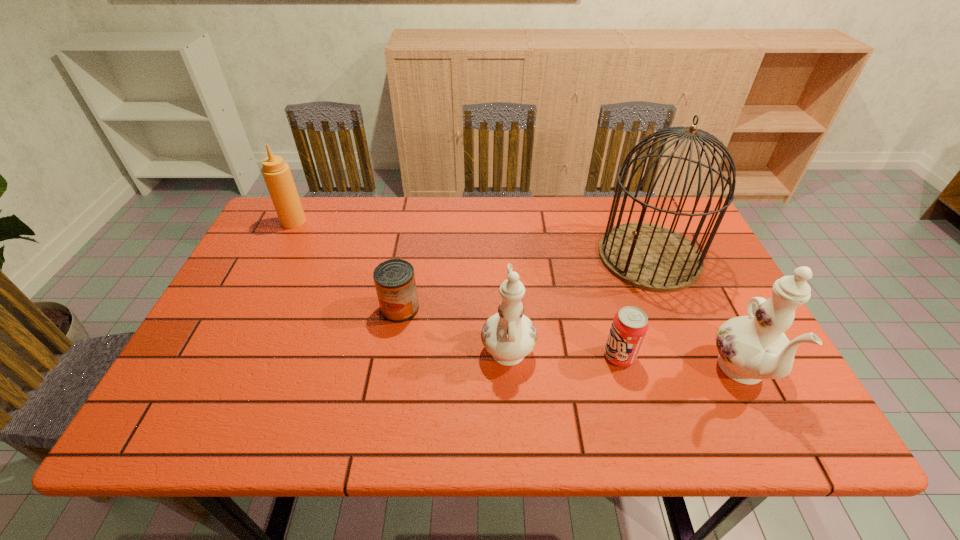
Find the location of a particular element. the left chinaware is located at coordinates (509, 336).

Identify the location of the shorter chinaware. (509, 336).

Locate an element on the screen. The height and width of the screenshot is (540, 960). the right chinaware is located at coordinates (751, 348).

You are a GUI agent. You are given a task and a screenshot of the screen. Output one action in this format:
    pyautogui.click(x=<x>, y=<y>)
    Task: Click on the condiment
    
    Given the screenshot: What is the action you would take?
    pyautogui.click(x=277, y=175)

You are a GUI agent. You are given a task and a screenshot of the screen. Output one action in this format:
    pyautogui.click(x=<x>, y=<y>)
    Task: Click on the birdcage
    This screenshot has width=960, height=540.
    Given the screenshot: What is the action you would take?
    pyautogui.click(x=648, y=256)

Locate an element on the screen. the fifth object from right to left is located at coordinates (394, 279).

Where is `soda can`? The width and height of the screenshot is (960, 540). soda can is located at coordinates (630, 325).

Identify the location of vacant space located at the spout of the fourth object from right to left. Image resolution: width=960 pixels, height=540 pixels. coord(505,300).

Where is `free space located at the spout of the fourth object from right to left`? This screenshot has width=960, height=540. free space located at the spout of the fourth object from right to left is located at coordinates (501, 230).

Find the location of `vacant region located 0.330m at the spout of the fourth object from right to left`. vacant region located 0.330m at the spout of the fourth object from right to left is located at coordinates (501, 236).